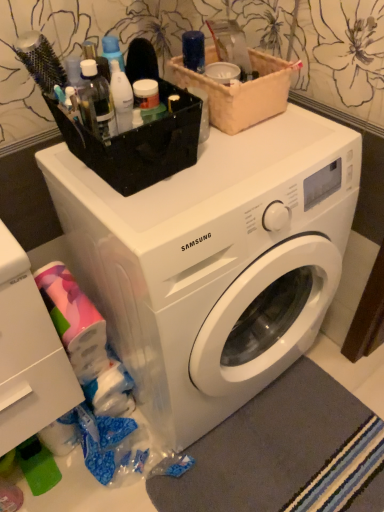
Where is `empty space that is ontop of white plastic washing machine at center (from a real-world perspective)`? Image resolution: width=384 pixels, height=512 pixels. empty space that is ontop of white plastic washing machine at center (from a real-world perspective) is located at coordinates (236, 167).